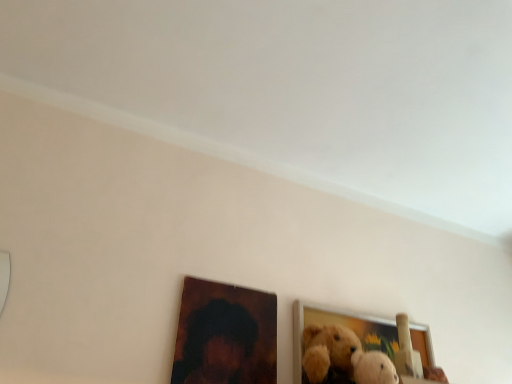
Question: Does wooden picture frame at lower center, the 2th picture frame when ordered from right to left, have a larger size compared to wooden picture frame at lower right, which is the 1th picture frame from right to left?

Choices:
 (A) no
 (B) yes

Answer: (A)

Question: From the image's perspective, is wooden picture frame at lower center, the 2th picture frame when ordered from right to left, on wooden picture frame at lower right, positioned as the 2th picture frame in left-to-right order?

Choices:
 (A) yes
 (B) no

Answer: (A)

Question: Is wooden picture frame at lower center, the 2th picture frame when ordered from right to left, thinner than wooden picture frame at lower right, which is the 1th picture frame from right to left?

Choices:
 (A) yes
 (B) no

Answer: (A)

Question: From the image's perspective, is wooden picture frame at lower center, arranged as the first picture frame when viewed from the left, under wooden picture frame at lower right, which is the 1th picture frame from right to left?

Choices:
 (A) no
 (B) yes

Answer: (A)

Question: From a real-world perspective, is wooden picture frame at lower center, arranged as the first picture frame when viewed from the left, over wooden picture frame at lower right, positioned as the 2th picture frame in left-to-right order?

Choices:
 (A) yes
 (B) no

Answer: (A)

Question: Can you confirm if wooden picture frame at lower center, arranged as the first picture frame when viewed from the left, is shorter than wooden picture frame at lower right, positioned as the 2th picture frame in left-to-right order?

Choices:
 (A) no
 (B) yes

Answer: (B)

Question: Would you say wooden picture frame at lower right, which is the 1th picture frame from right to left, is a long distance from wooden picture frame at lower center, the 2th picture frame when ordered from right to left?

Choices:
 (A) yes
 (B) no

Answer: (B)

Question: Is wooden picture frame at lower right, positioned as the 2th picture frame in left-to-right order, surrounding wooden picture frame at lower center, the 2th picture frame when ordered from right to left?

Choices:
 (A) yes
 (B) no

Answer: (B)

Question: From the image's perspective, is wooden picture frame at lower right, which is the 1th picture frame from right to left, over wooden picture frame at lower center, the 2th picture frame when ordered from right to left?

Choices:
 (A) no
 (B) yes

Answer: (A)

Question: Considering the relative sizes of wooden picture frame at lower right, which is the 1th picture frame from right to left, and wooden picture frame at lower center, the 2th picture frame when ordered from right to left, in the image provided, is wooden picture frame at lower right, which is the 1th picture frame from right to left, wider than wooden picture frame at lower center, the 2th picture frame when ordered from right to left,?

Choices:
 (A) yes
 (B) no

Answer: (A)

Question: Is wooden picture frame at lower right, which is the 1th picture frame from right to left, aimed at wooden picture frame at lower center, the 2th picture frame when ordered from right to left?

Choices:
 (A) yes
 (B) no

Answer: (B)

Question: Is wooden picture frame at lower right, which is the 1th picture frame from right to left, facing away from wooden picture frame at lower center, the 2th picture frame when ordered from right to left?

Choices:
 (A) no
 (B) yes

Answer: (A)

Question: In terms of height, does wooden picture frame at lower right, which is the 1th picture frame from right to left, look taller or shorter compared to wooden picture frame at lower center, the 2th picture frame when ordered from right to left?

Choices:
 (A) short
 (B) tall

Answer: (B)